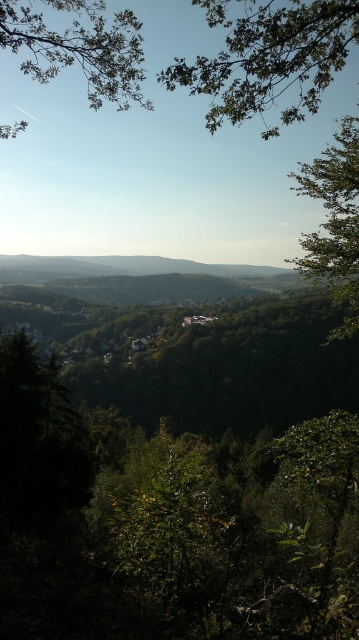
You are an artist sketching the landscape and want to ensure accuracy. Which object, the green leafy branch at upper center or the green leafy tree at upper left, is narrower in width?

The green leafy branch at upper center is narrower in width than the green leafy tree at upper left.

You are standing at the top of the hill and looking down at the landscape. You see a green leafy tree at upper left and a green leafy tree at right. Which tree is higher up in the scene?

The green leafy tree at upper left is higher up in the scene because it is located above the green leafy tree at right.

You are standing at the bottom of the hill and looking up. Which object, the green leafy tree at upper left or the green leafy hillside at center, is higher from your current position?

The green leafy tree at upper left is higher from your current position because it is located above the green leafy hillside at center.